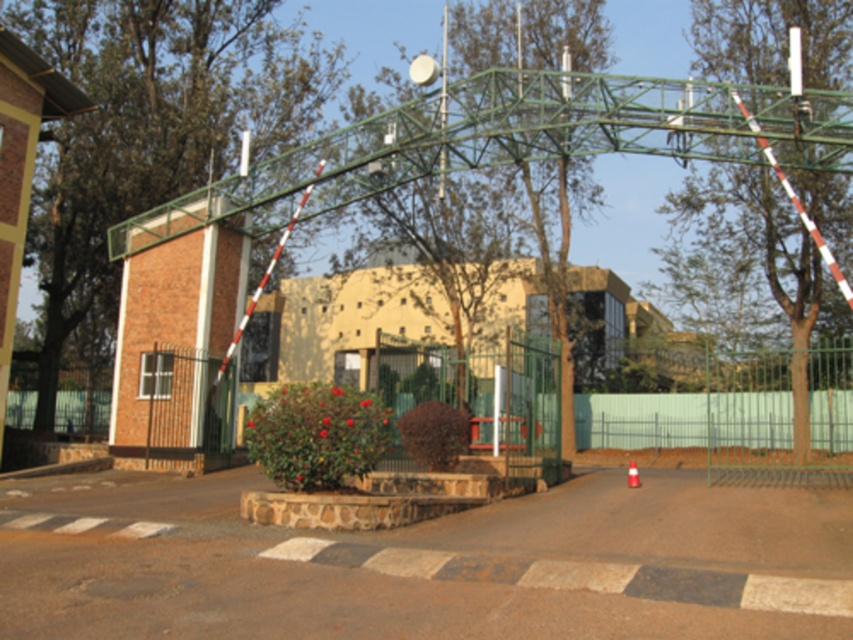
Which is behind, point (734, 445) or point (614, 432)?

The point (614, 432) is more distant.

Is green metal fence at right to the left of metallic fence at center from the viewer's perspective?

Correct, you'll find green metal fence at right to the left of metallic fence at center.

Who is more forward, (715, 451) or (666, 412)?

Point (715, 451)

The width and height of the screenshot is (853, 640). I want to click on green metal fence at right, so click(x=780, y=413).